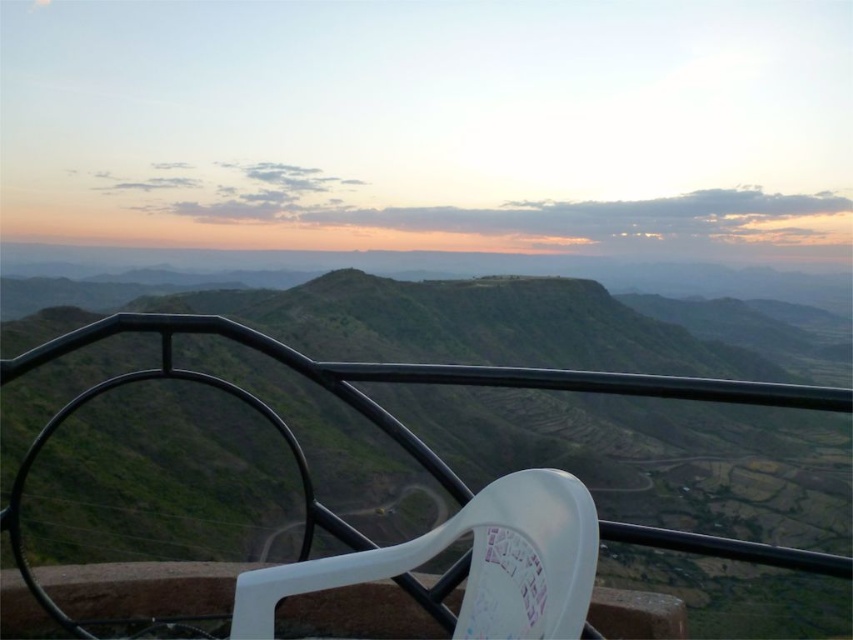
Is point (466, 323) behind point (461, 522)?

Yes.

Is point (22, 378) less distant than point (264, 570)?

No, it is behind (264, 570).

Which is behind, point (612, 472) or point (546, 630)?

Positioned behind is point (612, 472).

This screenshot has width=853, height=640. I want to click on green matte hill at center, so click(669, 486).